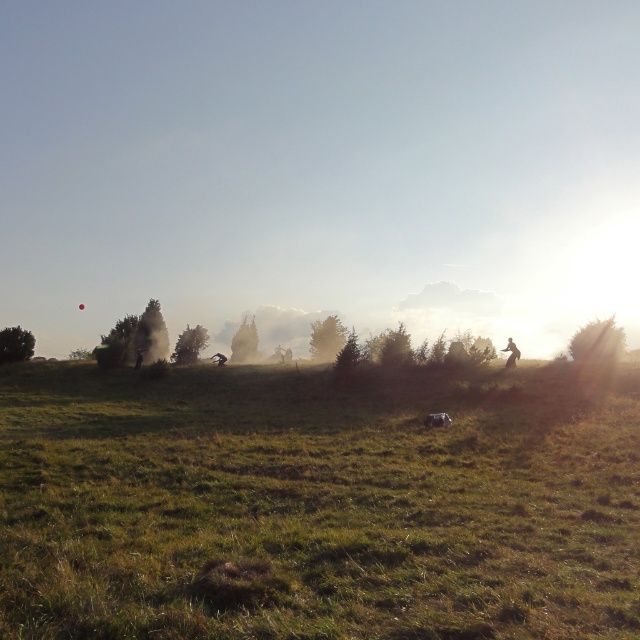
Who is taller, green grassy field at center or silhouette figure at right?

Standing taller between the two is green grassy field at center.

Can you confirm if green grassy field at center is wider than silhouette figure at right?

Yes.

At what (x,y) coordinates should I click in order to perform the action: click on green grassy field at center. Please return your answer as a coordinate pair (x, y). This screenshot has width=640, height=640. Looking at the image, I should click on (316, 504).